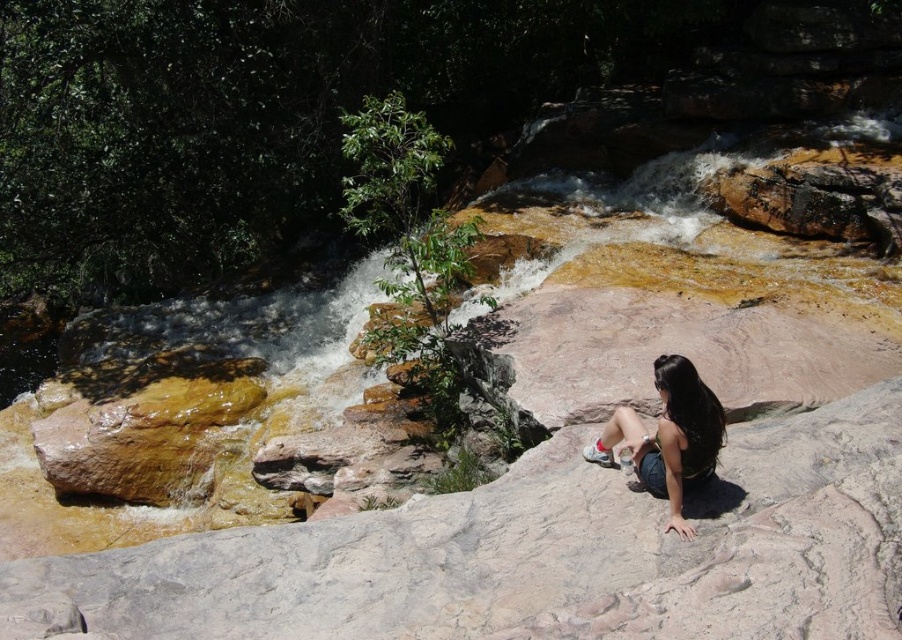
Question: Which point appears farthest from the camera in this image?

Choices:
 (A) (728, 544)
 (B) (672, 403)

Answer: (B)

Question: Which point is closer to the camera taking this photo?

Choices:
 (A) click(881, 499)
 (B) click(716, 454)

Answer: (A)

Question: Is smooth gray rock at center in front of matte black hair at center?

Choices:
 (A) no
 (B) yes

Answer: (B)

Question: Where is smooth gray rock at center located in relation to matte black hair at center in the image?

Choices:
 (A) above
 (B) below

Answer: (B)

Question: Which point is closer to the camera?

Choices:
 (A) smooth gray rock at center
 (B) matte black hair at center

Answer: (A)

Question: Observing the image, what is the correct spatial positioning of smooth gray rock at center in reference to matte black hair at center?

Choices:
 (A) below
 (B) above

Answer: (A)